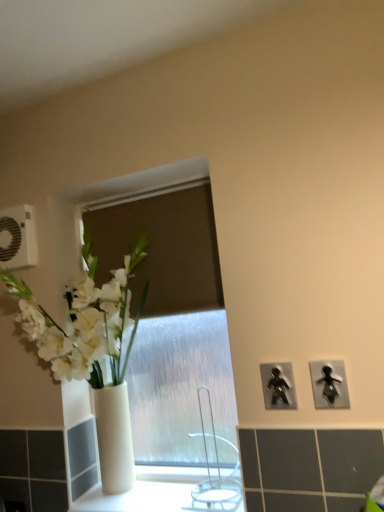
Question: Is black plastic figure at right, the third electric outlet positioned from the top, oriented away from white glossy vase at left?

Choices:
 (A) yes
 (B) no

Answer: (B)

Question: Considering the relative positions of black plastic figure at right, which is the 2th electric outlet in front-to-back order, and white glossy vase at left in the image provided, is black plastic figure at right, which is the 2th electric outlet in front-to-back order, in front of white glossy vase at left?

Choices:
 (A) no
 (B) yes

Answer: (A)

Question: From a real-world perspective, is black plastic figure at right, the 2th electric outlet when ordered from right to left, physically below white glossy vase at left?

Choices:
 (A) no
 (B) yes

Answer: (B)

Question: Does black plastic figure at right, the 2th electric outlet in the left-to-right sequence, have a lesser width compared to white glossy vase at left?

Choices:
 (A) no
 (B) yes

Answer: (B)

Question: From a real-world perspective, is black plastic figure at right, the 2th electric outlet when ordered from right to left, physically above white glossy vase at left?

Choices:
 (A) no
 (B) yes

Answer: (A)

Question: From a real-world perspective, is silver metallic faucet at center physically located above or below white glossy vase at left?

Choices:
 (A) below
 (B) above

Answer: (A)

Question: Considering the positions of silver metallic faucet at center and white glossy vase at left in the image, is silver metallic faucet at center wider or thinner than white glossy vase at left?

Choices:
 (A) wide
 (B) thin

Answer: (B)

Question: Is point (210, 485) closer or farther from the camera than point (41, 306)?

Choices:
 (A) farther
 (B) closer

Answer: (B)

Question: Is silver metallic faucet at center in front of or behind white glossy vase at left in the image?

Choices:
 (A) behind
 (B) front

Answer: (A)

Question: From the image's perspective, relative to white plastic electric outlet at upper left, acting as the third electric outlet starting from the front, is silver metallic faucet at center above or below?

Choices:
 (A) below
 (B) above

Answer: (A)

Question: Is silver metallic faucet at center wider or thinner than white plastic electric outlet at upper left, the 3th electric outlet from the bottom?

Choices:
 (A) thin
 (B) wide

Answer: (B)

Question: Is silver metallic faucet at center situated inside white plastic electric outlet at upper left, arranged as the 1th electric outlet when viewed from the left, or outside?

Choices:
 (A) inside
 (B) outside

Answer: (B)

Question: Does point (205, 486) appear closer or farther from the camera than point (6, 265)?

Choices:
 (A) farther
 (B) closer

Answer: (B)

Question: Is metallic silver figure at upper right, the second electric outlet from the top, bigger or smaller than black plastic figure at right, the third electric outlet positioned from the top?

Choices:
 (A) small
 (B) big

Answer: (A)

Question: From a real-world perspective, relative to black plastic figure at right, marked as the second electric outlet in a back-to-front arrangement, is metallic silver figure at upper right, which is the first electric outlet from right to left, vertically above or below?

Choices:
 (A) above
 (B) below

Answer: (B)